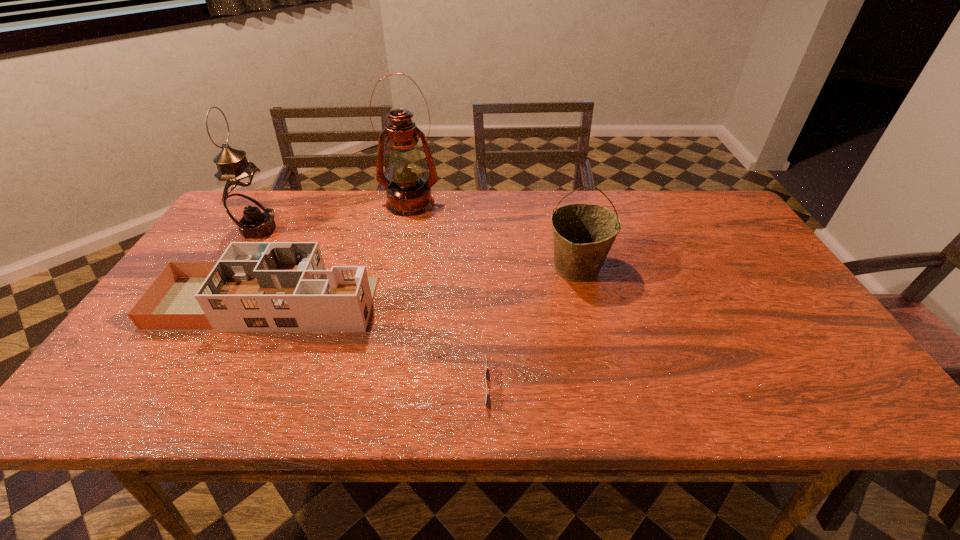
Locate an element on the screen. Image resolution: width=960 pixels, height=540 pixels. free spot located on the right of the second farthest object is located at coordinates (382, 230).

This screenshot has height=540, width=960. I want to click on free space located on the back of the wine bucket, so click(560, 196).

This screenshot has height=540, width=960. In order to click on free point located at the front door of the dollhouse in this screenshot , I will do `click(515, 303)`.

Where is `free region located 0.260m on the front-facing side of the shortest object`? The width and height of the screenshot is (960, 540). free region located 0.260m on the front-facing side of the shortest object is located at coordinates (612, 387).

Identify the location of object that is positioned at the near edge. The width and height of the screenshot is (960, 540). (485, 403).

This screenshot has width=960, height=540. Find the location of `oil lamp located in the left edge section of the desktop`. oil lamp located in the left edge section of the desktop is located at coordinates (244, 197).

The image size is (960, 540). I want to click on dollhouse that is at the left edge, so click(255, 286).

This screenshot has height=540, width=960. Identify the location of object present at the far left corner. (244, 197).

In the image, there is a desktop. In order to click on vacant space at the far edge in this screenshot , I will do `click(662, 227)`.

The width and height of the screenshot is (960, 540). In order to click on free location at the near edge of the desktop in this screenshot , I will do `click(716, 412)`.